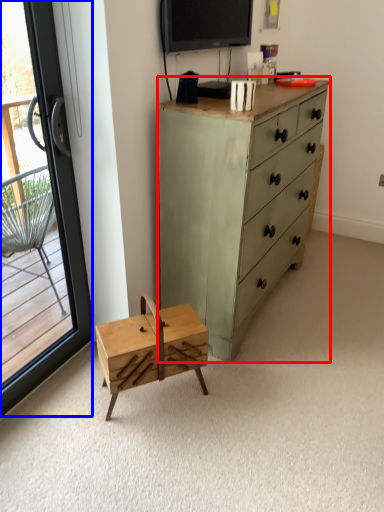
Question: Among these objects, which one is nearest to the camera, chest of drawers (highlighted by a red box) or window (highlighted by a blue box)?

Choices:
 (A) chest of drawers
 (B) window

Answer: (B)